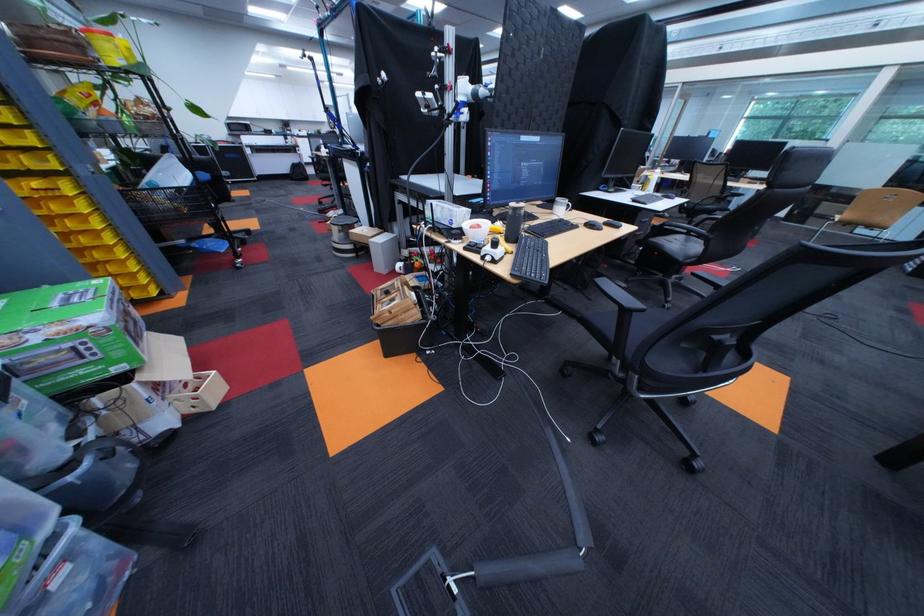
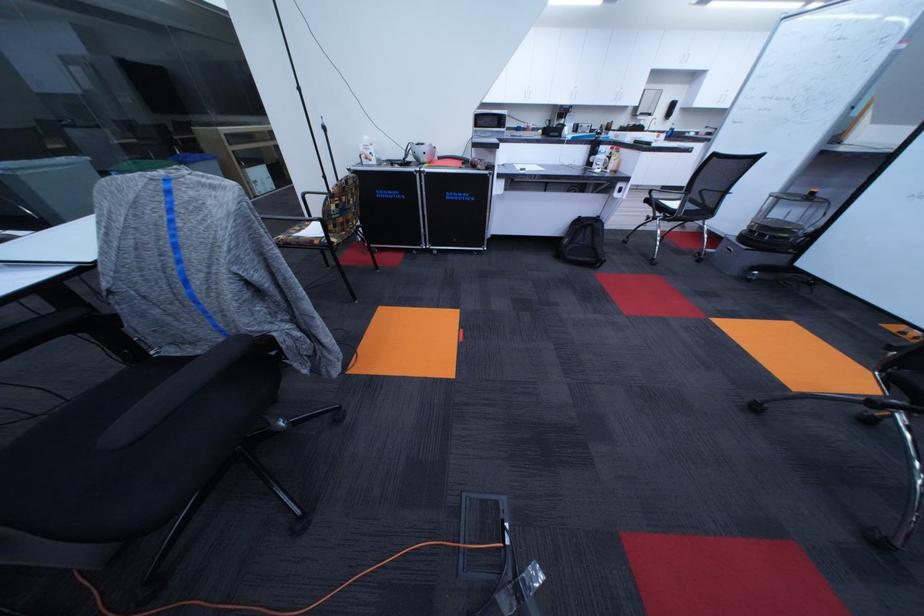
The point at (266,130) is marked in the first image. Where is the corresponding point in the second image?

(521, 124)